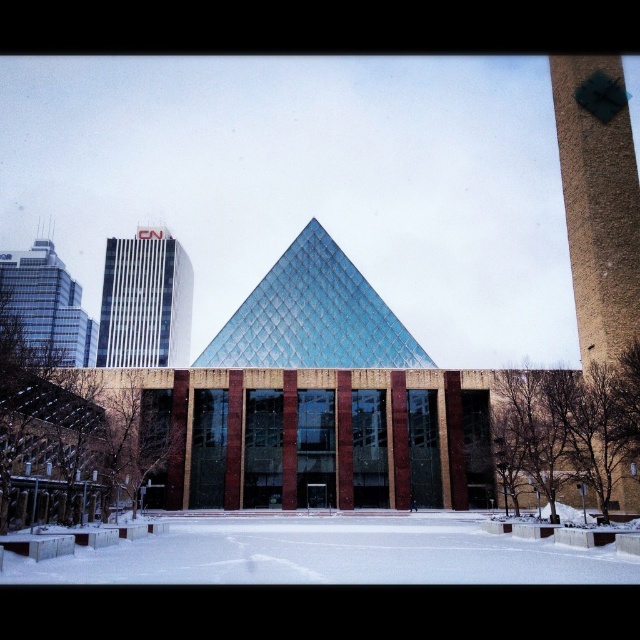
Can you confirm if brown textured tower at right is positioned to the left of glassy reflective skyscraper at left?

Incorrect, brown textured tower at right is not on the left side of glassy reflective skyscraper at left.

Can you confirm if brown textured tower at right is taller than glassy reflective skyscraper at left?

In fact, brown textured tower at right may be shorter than glassy reflective skyscraper at left.

Find the location of a particular element. The image size is (640, 640). brown textured tower at right is located at coordinates (598, 202).

This screenshot has width=640, height=640. In order to click on brown textured tower at right in this screenshot , I will do `click(598, 202)`.

Between brown textured tower at right and white glass building at upper left, which one appears on the right side from the viewer's perspective?

From the viewer's perspective, brown textured tower at right appears more on the right side.

Find the location of a particular element. The height and width of the screenshot is (640, 640). brown textured tower at right is located at coordinates (598, 202).

Is white glass building at upper left further to camera compared to glassy reflective skyscraper at left?

No, white glass building at upper left is in front of glassy reflective skyscraper at left.

Who is taller, white glass building at upper left or glassy reflective skyscraper at left?

glassy reflective skyscraper at left is taller.

Between point (160, 280) and point (49, 316), which one is positioned behind?

The point (49, 316) is more distant.

Identify the location of white glass building at upper left. coord(145,301).